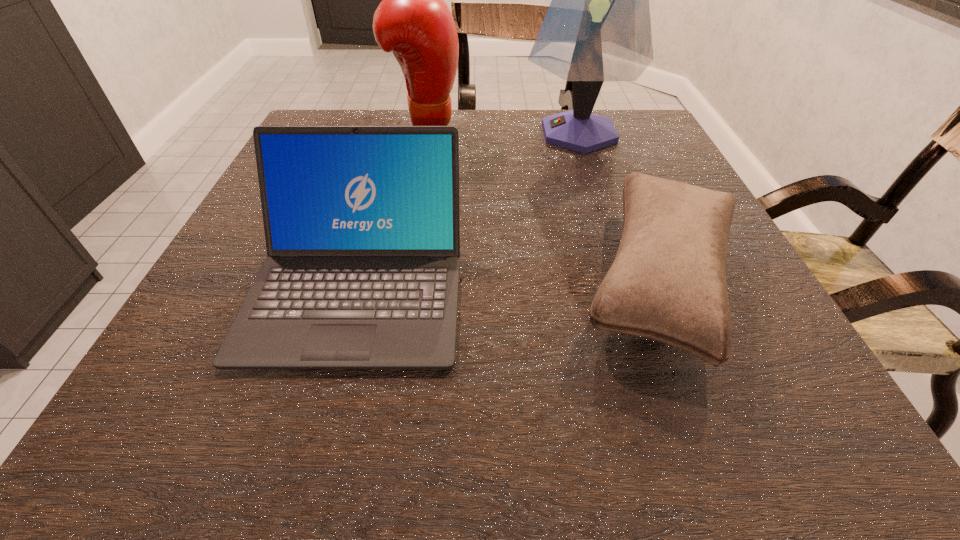
I want to click on free location that satisfies the following two spatial constraints: 1. on the striking surface of the shortest object; 2. on the right side of the third shortest object, so click(x=397, y=279).

Locate an element on the screen. Image resolution: width=960 pixels, height=540 pixels. free space in the image that satisfies the following two spatial constraints: 1. on the back side of the shortest object; 2. on the base of the lampshade is located at coordinates (600, 133).